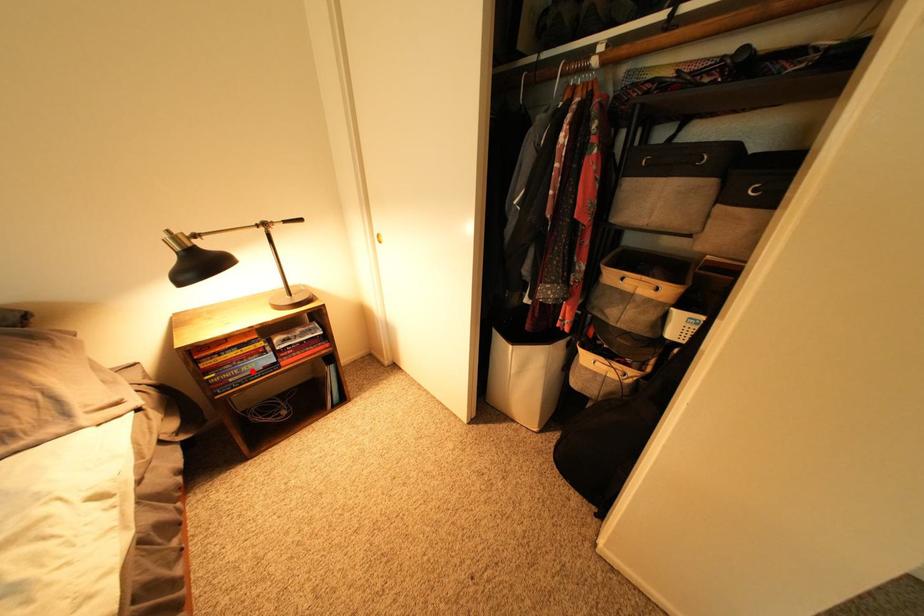
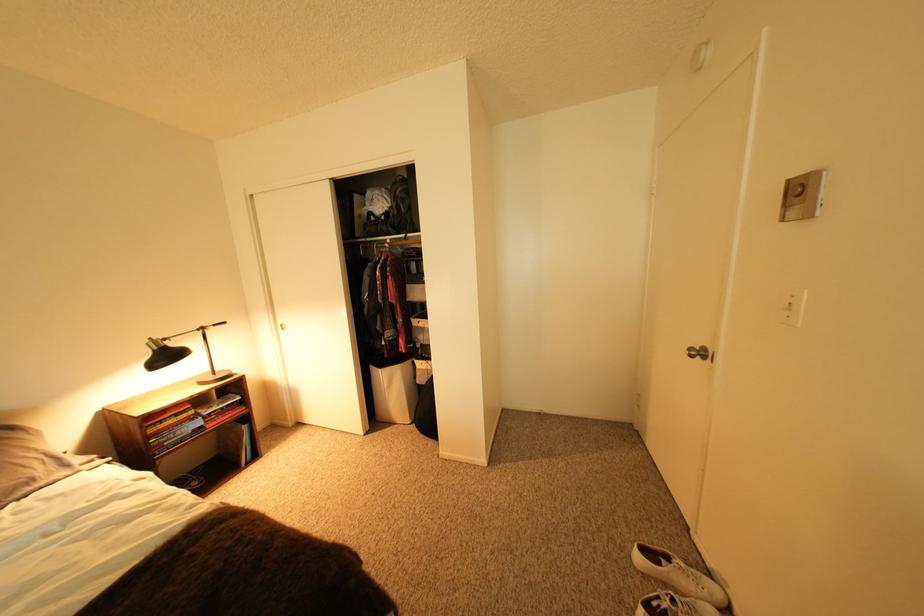
The point at the highlighted location is marked in the first image. Where is the corresponding point in the second image?

(188, 435)